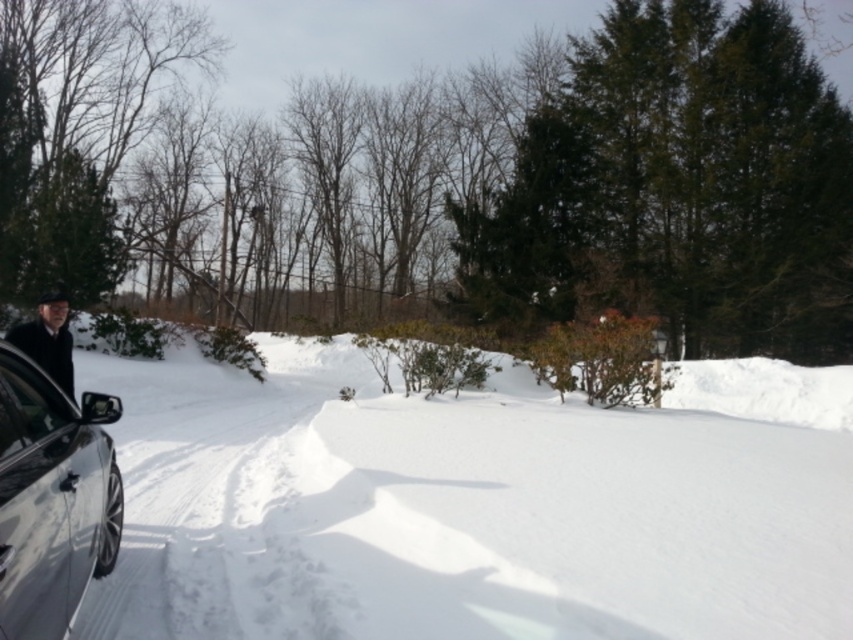
Consider the image. Is white fluffy snow at lower left below clear glass window at lower left?

Correct, white fluffy snow at lower left is located below clear glass window at lower left.

Which is in front, point (206, 618) or point (25, 364)?

Point (25, 364) is in front.

At what (x,y) coordinates should I click in order to perform the action: click on white fluffy snow at lower left. Please return your answer as a coordinate pair (x, y). Looking at the image, I should click on (474, 502).

The width and height of the screenshot is (853, 640). In order to click on shiny metallic car at left in this screenshot , I will do `click(51, 497)`.

Does shiny metallic car at left come in front of clear glass window at lower left?

Yes, it is.

Between point (84, 397) and point (12, 451), which one is positioned in front?

Positioned in front is point (12, 451).

At what (x,y) coordinates should I click in order to perform the action: click on shiny metallic car at left. Please return your answer as a coordinate pair (x, y). This screenshot has height=640, width=853. Looking at the image, I should click on (51, 497).

Is the position of white fluffy snow at lower left less distant than that of shiny metallic car at left?

No.

Is white fluffy snow at lower left positioned at the back of shiny metallic car at left?

Yes, white fluffy snow at lower left is further from the viewer.

Image resolution: width=853 pixels, height=640 pixels. In order to click on white fluffy snow at lower left in this screenshot , I will do 474,502.